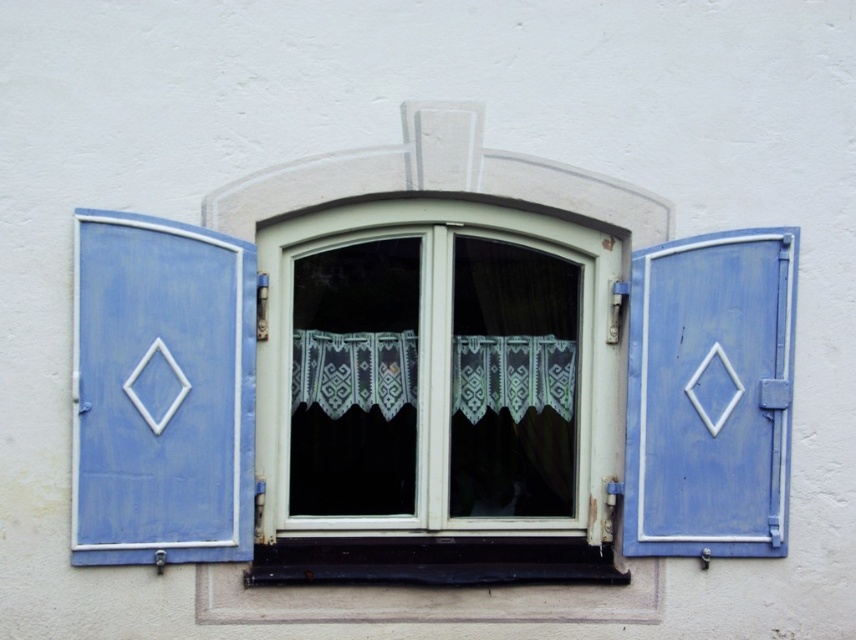
You are a painter standing at the base of the wall where the black painted wood at lower center is located. You need to reach the matte blue wooden shutter at left to touch it. Can you reach it without moving your feet?

The distance between the matte blue wooden shutter at left and the black painted wood at lower center is 26.44 inches. Since the average arm length of an adult is about 25 inches, you might not be able to reach the matte blue wooden shutter at left from your current position without moving your feet.

You are standing in front of the window and want to close the matte blue wooden shutter at left. Where exactly should you reach to grab it?

You should reach to the coordinates point at (161, 392) to grab the matte blue wooden shutter at left.